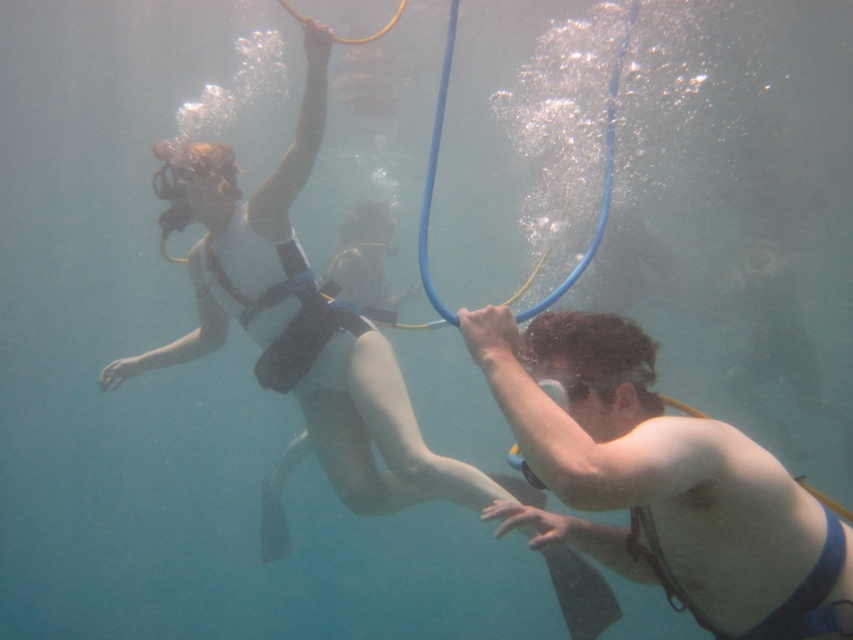
You are a marine biologist observing two divers underwater. You notice a smooth skin diver at center and a matte black wetsuit at center. Based on their sizes, which diver might be more experienced in cold water environments?

The matte black wetsuit at center is larger in size compared to the smooth skin diver at center. Experienced divers often choose larger wetsuits for better thermal protection in cold water, so the matte black wetsuit at center might belong to a more experienced diver.

You are a marine biologist observing an underwater scene with a smooth skin diver at center and a matte black wetsuit at center. Which object is taller?

The smooth skin diver at center is not as tall as the matte black wetsuit at center, so the matte black wetsuit at center is taller.